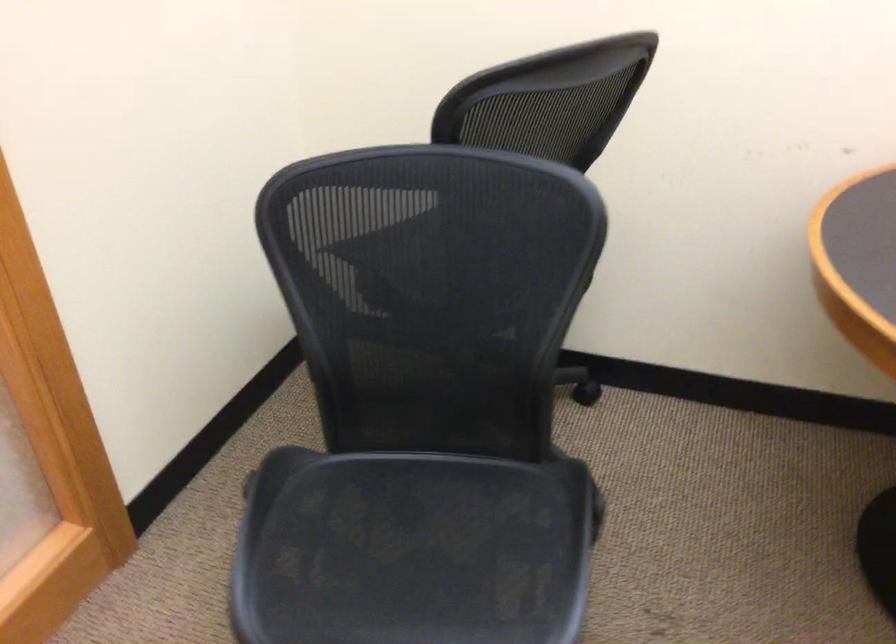
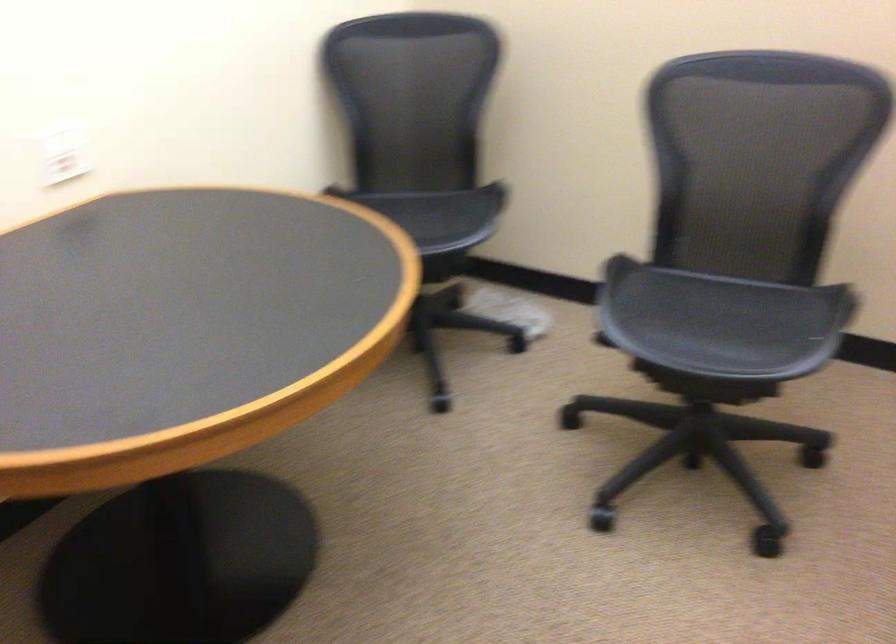
The images are taken continuously from a first-person perspective. In which direction is your viewpoint rotating?

→ The rotation direction of the camera is right-down.